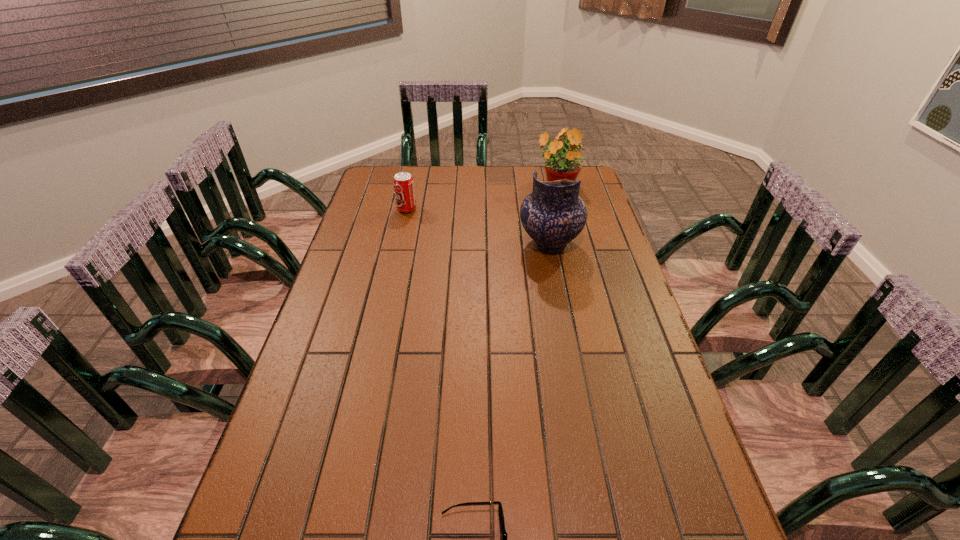
I want to click on object that is the third closest to the flowerpot, so click(x=500, y=510).

Identify which object is the third nearest to the sunglasses. Please provide its 2D coordinates. Your answer should be formatted as a tuple, i.e. [(x, y)], where the tuple contains the x and y coordinates of a point satisfying the conditions above.

[(559, 165)]

I want to click on free location that satisfies the following two spatial constraints: 1. on the back side of the third tallest object; 2. on the right side of the flowerpot, so [x=412, y=186].